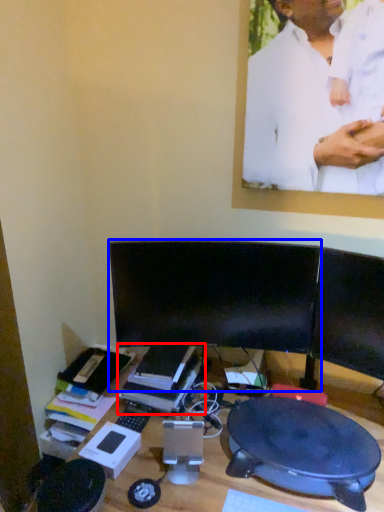
Question: Which point is closer to the camera, book (highlighted by a red box) or computer monitor (highlighted by a blue box)?

Choices:
 (A) book
 (B) computer monitor

Answer: (B)